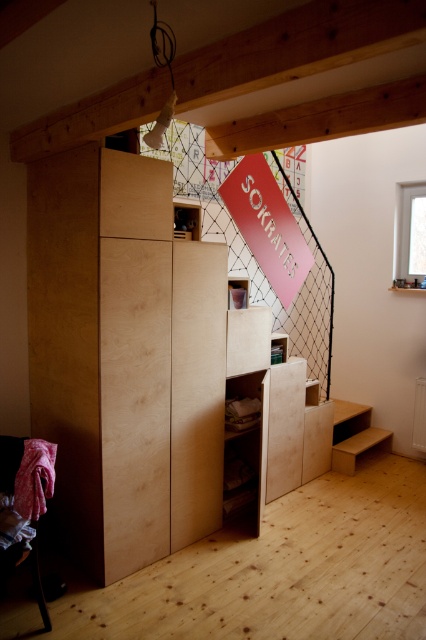
Which is in front, point (287, 298) or point (371, 442)?

Point (287, 298) is more forward.

Which is more to the left, matte pink sign at upper center or light wood/stained wood stair at lower right?

matte pink sign at upper center is more to the left.

Which is in front, point (233, 177) or point (371, 435)?

Positioned in front is point (233, 177).

Where is `matte pink sign at upper center`? Image resolution: width=426 pixels, height=640 pixels. matte pink sign at upper center is located at coordinates (267, 225).